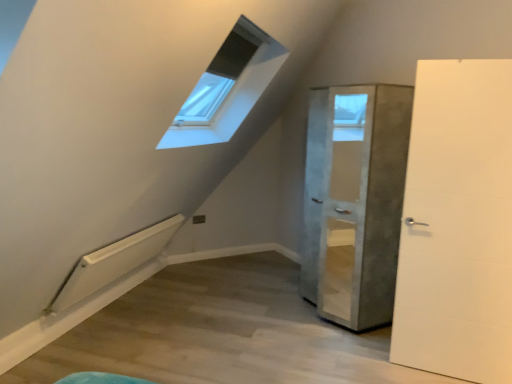
Identify the location of white matte door at right, which is the 1th door from front to back. (457, 224).

The image size is (512, 384). What do you see at coordinates (457, 224) in the screenshot?
I see `white matte door at right, which is the 1th door from front to back` at bounding box center [457, 224].

Measure the distance between point (435, 63) and camera.

Point (435, 63) and camera are 2.68 meters apart from each other.

Find the location of `concrete textured cabinet at center, the second door when ordered from front to back`. concrete textured cabinet at center, the second door when ordered from front to back is located at coordinates (355, 201).

What do you see at coordinates (355, 201) in the screenshot? The height and width of the screenshot is (384, 512). I see `concrete textured cabinet at center, positioned as the 1th door in back-to-front order` at bounding box center [355, 201].

Measure the distance between point (348, 180) and camera.

Point (348, 180) is 15.30 feet from camera.

How much space does concrete textured cabinet at center, positioned as the 1th door in back-to-front order, occupy vertically?

6.11 feet.

The width and height of the screenshot is (512, 384). What are the coordinates of `white matte door at right, marked as the 2th door in a back-to-front arrangement` in the screenshot? It's located at (457, 224).

Which is more to the left, white matte door at right, which is the 1th door from front to back, or concrete textured cabinet at center, positioned as the 1th door in back-to-front order?

concrete textured cabinet at center, positioned as the 1th door in back-to-front order.

Is the position of white matte door at right, which is the 1th door from front to back, less distant than that of concrete textured cabinet at center, positioned as the 1th door in back-to-front order?

Yes, white matte door at right, which is the 1th door from front to back, is in front of concrete textured cabinet at center, positioned as the 1th door in back-to-front order.

Considering the points (477, 348) and (344, 87), which point is behind, point (477, 348) or point (344, 87)?

Positioned behind is point (344, 87).

From the image's perspective, is white matte door at right, which is the 1th door from front to back, beneath concrete textured cabinet at center, the second door when ordered from front to back?

Yes.

From a real-world perspective, is white matte door at right, which is the 1th door from front to back, under concrete textured cabinet at center, positioned as the 1th door in back-to-front order?

Actually, white matte door at right, which is the 1th door from front to back, is physically above concrete textured cabinet at center, positioned as the 1th door in back-to-front order, in the real world.

Considering the sizes of objects white matte door at right, which is the 1th door from front to back, and concrete textured cabinet at center, positioned as the 1th door in back-to-front order, in the image provided, who is wider, white matte door at right, which is the 1th door from front to back, or concrete textured cabinet at center, positioned as the 1th door in back-to-front order,?

concrete textured cabinet at center, positioned as the 1th door in back-to-front order, is wider.

Considering the sizes of objects white matte door at right, which is the 1th door from front to back, and concrete textured cabinet at center, positioned as the 1th door in back-to-front order, in the image provided, who is shorter, white matte door at right, which is the 1th door from front to back, or concrete textured cabinet at center, positioned as the 1th door in back-to-front order,?

concrete textured cabinet at center, positioned as the 1th door in back-to-front order, is shorter.

Is white matte door at right, marked as the 2th door in a back-to-front arrangement, bigger than concrete textured cabinet at center, positioned as the 1th door in back-to-front order?

No.

Which is correct: white matte door at right, marked as the 2th door in a back-to-front arrangement, is inside concrete textured cabinet at center, positioned as the 1th door in back-to-front order, or outside of it?

white matte door at right, marked as the 2th door in a back-to-front arrangement, is not inside concrete textured cabinet at center, positioned as the 1th door in back-to-front order, it's outside.

Is white matte door at right, marked as the 2th door in a back-to-front arrangement, directly adjacent to concrete textured cabinet at center, positioned as the 1th door in back-to-front order?

No, white matte door at right, marked as the 2th door in a back-to-front arrangement, is not in contact with concrete textured cabinet at center, positioned as the 1th door in back-to-front order.

Is white matte door at right, which is the 1th door from front to back, oriented towards concrete textured cabinet at center, the second door when ordered from front to back?

No, white matte door at right, which is the 1th door from front to back, is not turned towards concrete textured cabinet at center, the second door when ordered from front to back.

Find the location of `door behind the white matte door at right, marked as the 2th door in a back-to-front arrangement`. door behind the white matte door at right, marked as the 2th door in a back-to-front arrangement is located at coordinates (355, 201).

Is concrete textured cabinet at center, positioned as the 1th door in back-to-front order, to the left or to the right of white matte door at right, marked as the 2th door in a back-to-front arrangement, in the image?

From the image, it's evident that concrete textured cabinet at center, positioned as the 1th door in back-to-front order, is to the left of white matte door at right, marked as the 2th door in a back-to-front arrangement.

Is concrete textured cabinet at center, positioned as the 1th door in back-to-front order, further to the viewer compared to white matte door at right, marked as the 2th door in a back-to-front arrangement?

Yes, concrete textured cabinet at center, positioned as the 1th door in back-to-front order, is further from the camera.

Is point (389, 231) less distant than point (452, 286)?

No, it is behind (452, 286).

From the image's perspective, between concrete textured cabinet at center, the second door when ordered from front to back, and white matte door at right, which is the 1th door from front to back, who is located below?

white matte door at right, which is the 1th door from front to back, appears lower in the image.

From a real-world perspective, does concrete textured cabinet at center, positioned as the 1th door in back-to-front order, stand above white matte door at right, which is the 1th door from front to back?

No, from a real-world perspective, concrete textured cabinet at center, positioned as the 1th door in back-to-front order, is not above white matte door at right, which is the 1th door from front to back.

Considering the relative sizes of concrete textured cabinet at center, positioned as the 1th door in back-to-front order, and white matte door at right, which is the 1th door from front to back, in the image provided, is concrete textured cabinet at center, positioned as the 1th door in back-to-front order, thinner than white matte door at right, which is the 1th door from front to back,?

In fact, concrete textured cabinet at center, positioned as the 1th door in back-to-front order, might be wider than white matte door at right, which is the 1th door from front to back.

Considering the sizes of objects concrete textured cabinet at center, positioned as the 1th door in back-to-front order, and white matte door at right, marked as the 2th door in a back-to-front arrangement, in the image provided, who is shorter, concrete textured cabinet at center, positioned as the 1th door in back-to-front order, or white matte door at right, marked as the 2th door in a back-to-front arrangement,?

concrete textured cabinet at center, positioned as the 1th door in back-to-front order, is shorter.

Looking at the image, does concrete textured cabinet at center, positioned as the 1th door in back-to-front order, seem bigger or smaller compared to white matte door at right, marked as the 2th door in a back-to-front arrangement?

In the image, concrete textured cabinet at center, positioned as the 1th door in back-to-front order, appears to be larger than white matte door at right, marked as the 2th door in a back-to-front arrangement.

Would you say white matte door at right, which is the 1th door from front to back, is part of concrete textured cabinet at center, the second door when ordered from front to back,'s contents?

No, white matte door at right, which is the 1th door from front to back, is not a part of concrete textured cabinet at center, the second door when ordered from front to back.

Are concrete textured cabinet at center, the second door when ordered from front to back, and white matte door at right, marked as the 2th door in a back-to-front arrangement, located far from each other?

Actually, concrete textured cabinet at center, the second door when ordered from front to back, and white matte door at right, marked as the 2th door in a back-to-front arrangement, are a little close together.

In the scene shown: Does concrete textured cabinet at center, positioned as the 1th door in back-to-front order, turn towards white matte door at right, which is the 1th door from front to back?

No, concrete textured cabinet at center, positioned as the 1th door in back-to-front order, is not facing towards white matte door at right, which is the 1th door from front to back.

Measure the distance between concrete textured cabinet at center, positioned as the 1th door in back-to-front order, and white matte door at right, which is the 1th door from front to back.

24.44 inches.

This screenshot has width=512, height=384. Identify the location of door that appears below the concrete textured cabinet at center, positioned as the 1th door in back-to-front order (from the image's perspective). (457, 224).

Locate an element on the screen. door that is above the concrete textured cabinet at center, positioned as the 1th door in back-to-front order (from a real-world perspective) is located at coordinates (457, 224).

Locate an element on the screen. Image resolution: width=512 pixels, height=384 pixels. door in front of the concrete textured cabinet at center, positioned as the 1th door in back-to-front order is located at coordinates (457, 224).